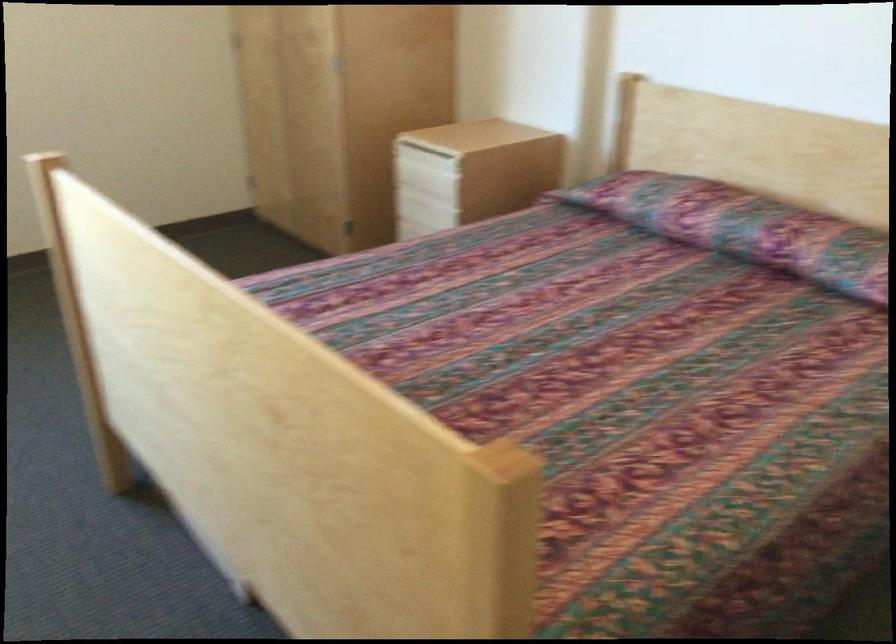
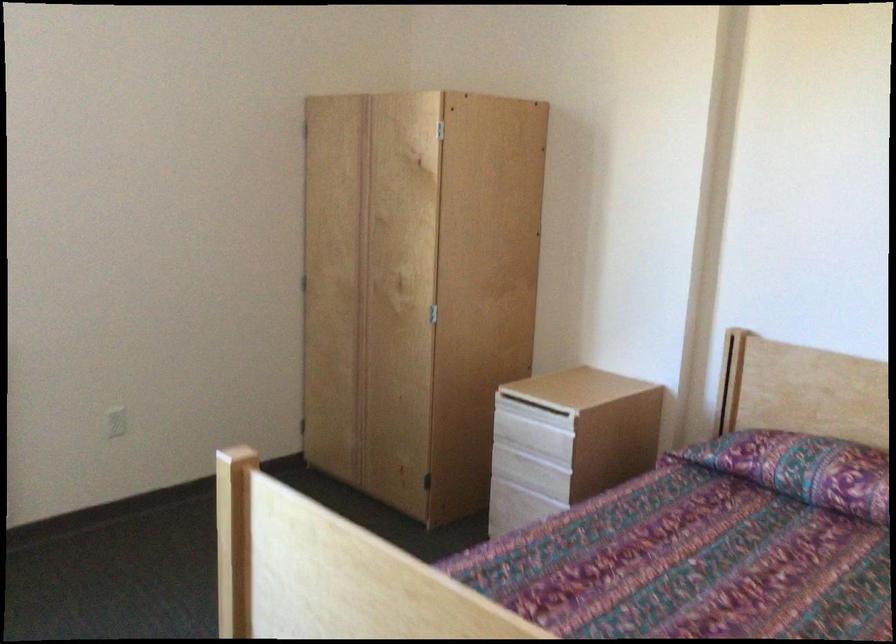
Question: The first image is from the beginning of the video and the second image is from the end. How did the camera likely rotate when shooting the video?

Choices:
 (A) Left
 (B) Right
 (C) Up
 (D) Down

Answer: (C)